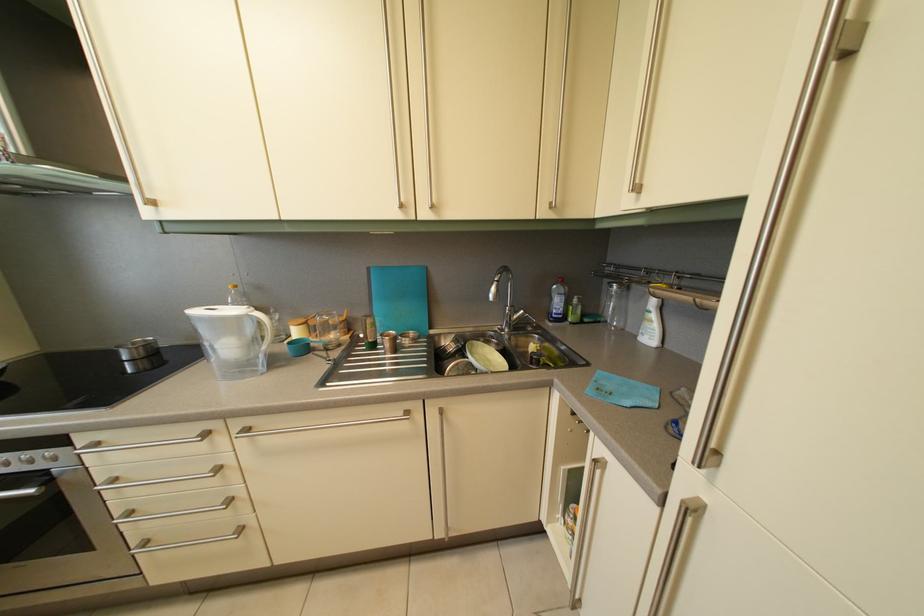
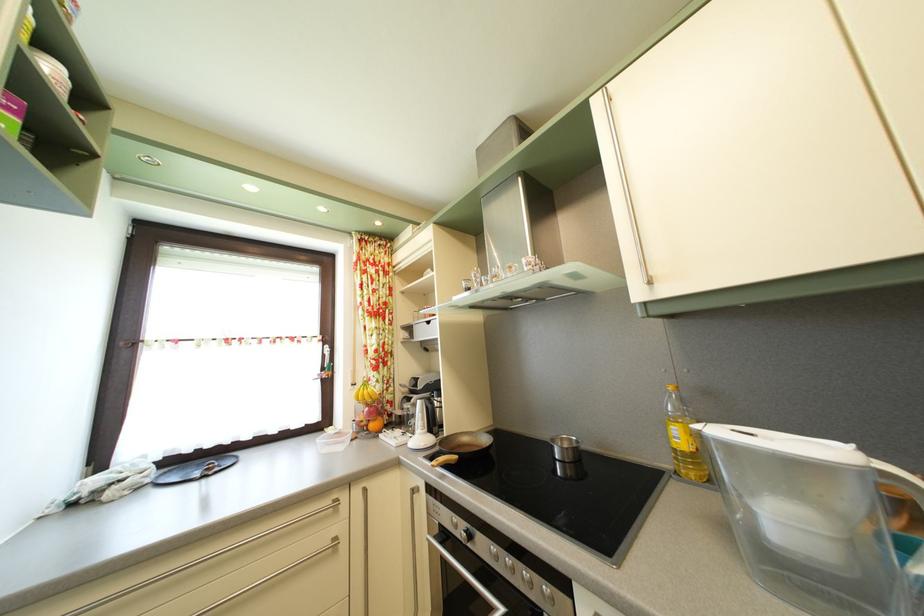
The point at [238,294] is marked in the first image. Where is the corresponding point in the second image?

(678, 395)